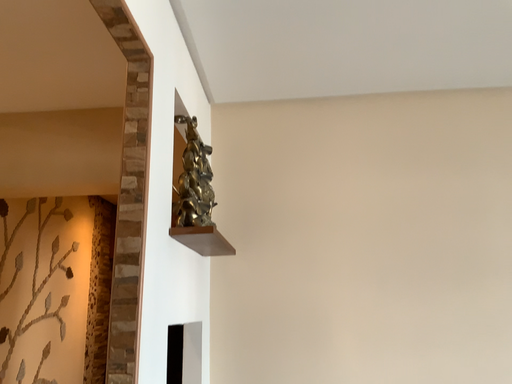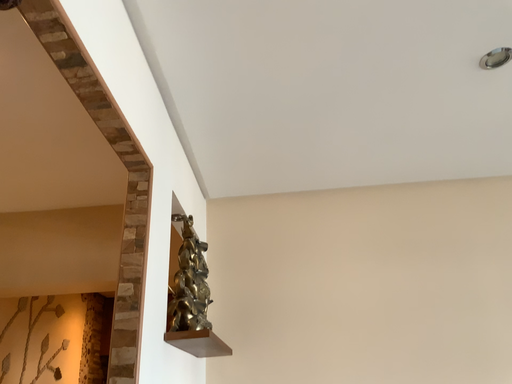
Question: How did the camera likely rotate when shooting the video?

Choices:
 (A) rotated upward
 (B) rotated downward

Answer: (A)